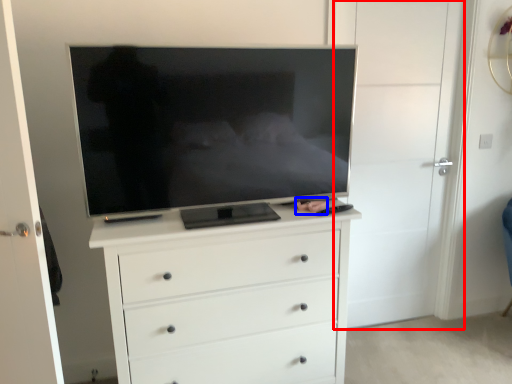
Question: Among these objects, which one is nearest to the camera, door (highlighted by a red box) or person (highlighted by a blue box)?

Choices:
 (A) door
 (B) person

Answer: (B)